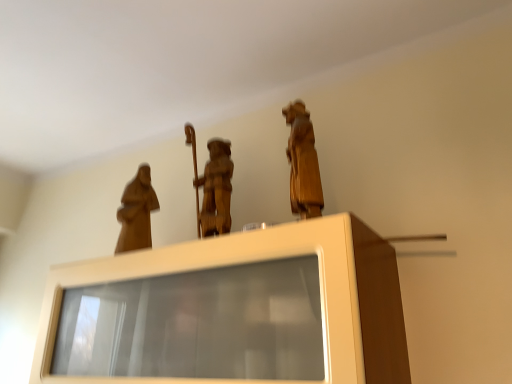
Question: Is matte wood statue at left, the first person positioned from the left, next to matte wood cabinet at center and touching it?

Choices:
 (A) no
 (B) yes

Answer: (A)

Question: Considering the relative sizes of matte wood statue at left, the second person in the right-to-left sequence, and matte wood cabinet at center in the image provided, is matte wood statue at left, the second person in the right-to-left sequence, shorter than matte wood cabinet at center?

Choices:
 (A) yes
 (B) no

Answer: (A)

Question: Is matte wood cabinet at center completely or partially inside matte wood statue at left, marked as the second person in a front-to-back arrangement?

Choices:
 (A) yes
 (B) no

Answer: (B)

Question: From a real-world perspective, is matte wood statue at left, marked as the second person in a front-to-back arrangement, positioned over matte wood cabinet at center based on gravity?

Choices:
 (A) yes
 (B) no

Answer: (A)

Question: Considering the relative positions of matte wood statue at left, the second person in the right-to-left sequence, and matte wood cabinet at center in the image provided, is matte wood statue at left, the second person in the right-to-left sequence, behind matte wood cabinet at center?

Choices:
 (A) no
 (B) yes

Answer: (B)

Question: In terms of size, does matte wood cabinet at center appear bigger or smaller than matte wood statue at left, the second person in the right-to-left sequence?

Choices:
 (A) small
 (B) big

Answer: (B)

Question: Looking at their shapes, would you say matte wood cabinet at center is wider or thinner than matte wood statue at left, the first person positioned from the left?

Choices:
 (A) thin
 (B) wide

Answer: (B)

Question: Relative to matte wood statue at left, the first person positioned from the left, is matte wood cabinet at center in front or behind?

Choices:
 (A) behind
 (B) front

Answer: (B)

Question: Based on their positions, is matte wood cabinet at center located to the left or right of matte wood statue at left, the first person positioned from the left?

Choices:
 (A) left
 (B) right

Answer: (B)

Question: In terms of size, does matte wood statue at left, the 1th person from the back, appear bigger or smaller than wooden statue at upper center, the first person viewed from the right?

Choices:
 (A) small
 (B) big

Answer: (A)

Question: Is point (145, 243) positioned closer to the camera than point (318, 177)?

Choices:
 (A) farther
 (B) closer

Answer: (A)

Question: In the image, is matte wood statue at left, the second person in the right-to-left sequence, positioned in front of or behind wooden statue at upper center, the 2th person viewed from the left?

Choices:
 (A) front
 (B) behind

Answer: (B)

Question: From the image's perspective, is matte wood statue at left, the first person positioned from the left, located above or below wooden statue at upper center, the 2th person viewed from the left?

Choices:
 (A) above
 (B) below

Answer: (B)

Question: From a real-world perspective, relative to matte wood statue at left, the first person positioned from the left, is wooden statue at upper center, the 2th person viewed from the left, vertically above or below?

Choices:
 (A) below
 (B) above

Answer: (A)

Question: Looking at their shapes, would you say wooden statue at upper center, the 2th person viewed from the left, is wider or thinner than matte wood statue at left, the 1th person from the back?

Choices:
 (A) wide
 (B) thin

Answer: (A)